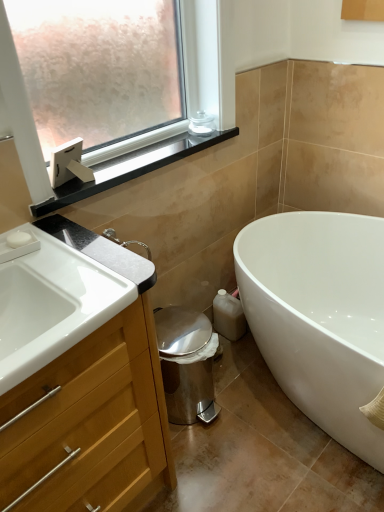
Question: Does white glossy bathtub at lower right come behind wooden cabinet at left?

Choices:
 (A) no
 (B) yes

Answer: (B)

Question: Is white glossy bathtub at lower right facing towards wooden cabinet at left?

Choices:
 (A) no
 (B) yes

Answer: (B)

Question: Does white glossy bathtub at lower right have a lesser height compared to wooden cabinet at left?

Choices:
 (A) no
 (B) yes

Answer: (B)

Question: From a real-world perspective, is white glossy bathtub at lower right positioned over wooden cabinet at left based on gravity?

Choices:
 (A) no
 (B) yes

Answer: (A)

Question: Is white glossy bathtub at lower right positioned with its back to wooden cabinet at left?

Choices:
 (A) yes
 (B) no

Answer: (B)

Question: In terms of height, does white matte soap at upper left look taller or shorter compared to white glossy bathtub at lower right?

Choices:
 (A) tall
 (B) short

Answer: (B)

Question: From a real-world perspective, relative to white glossy bathtub at lower right, is white matte soap at upper left vertically above or below?

Choices:
 (A) above
 (B) below

Answer: (A)

Question: Considering the positions of white matte soap at upper left and white glossy bathtub at lower right in the image, is white matte soap at upper left wider or thinner than white glossy bathtub at lower right?

Choices:
 (A) wide
 (B) thin

Answer: (B)

Question: Is point (19, 245) positioned closer to the camera than point (269, 265)?

Choices:
 (A) closer
 (B) farther

Answer: (A)

Question: Would you say white glossy sink at lower left is to the left or to the right of clear glass jar at upper center in the picture?

Choices:
 (A) right
 (B) left

Answer: (B)

Question: Considering the positions of point (13, 301) and point (213, 126), is point (13, 301) closer or farther from the camera than point (213, 126)?

Choices:
 (A) closer
 (B) farther

Answer: (A)

Question: Considering the positions of white glossy sink at lower left and clear glass jar at upper center in the image, is white glossy sink at lower left bigger or smaller than clear glass jar at upper center?

Choices:
 (A) big
 (B) small

Answer: (A)

Question: In terms of height, does white glossy sink at lower left look taller or shorter compared to clear glass jar at upper center?

Choices:
 (A) short
 (B) tall

Answer: (B)

Question: Is wooden cabinet at left inside or outside of white glossy bathtub at lower right?

Choices:
 (A) outside
 (B) inside

Answer: (A)

Question: Looking at the image, does wooden cabinet at left seem bigger or smaller compared to white glossy bathtub at lower right?

Choices:
 (A) big
 (B) small

Answer: (B)